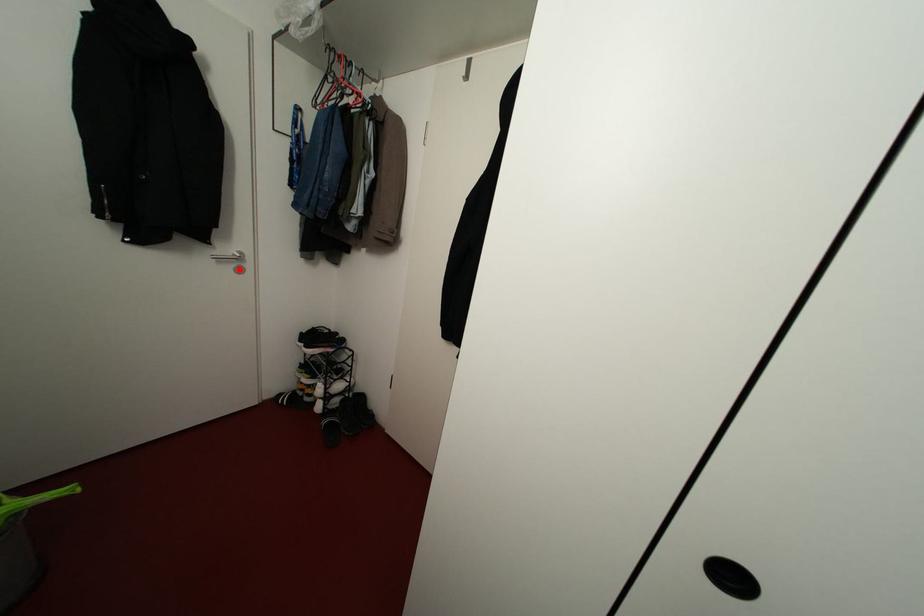
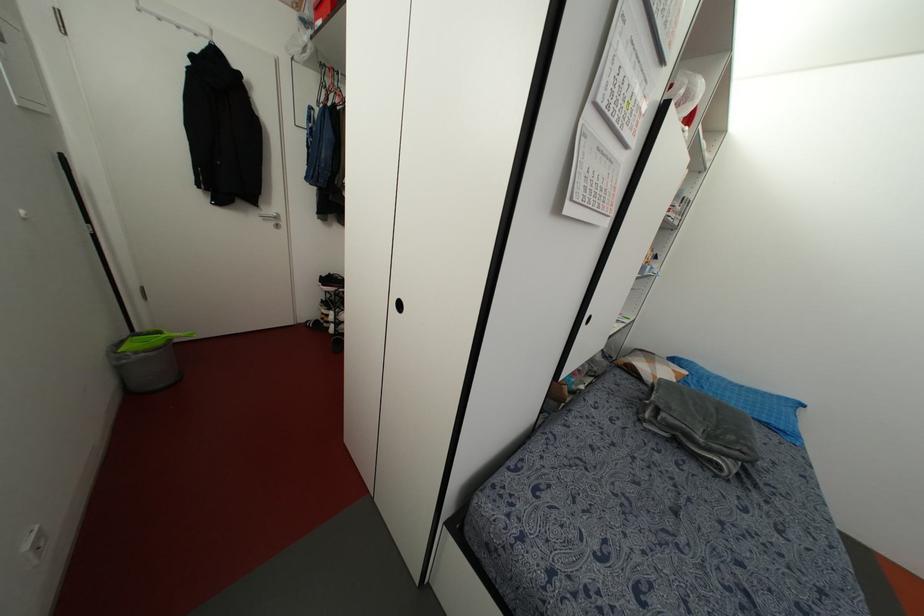
Where in the second image is the point corresponding to the highlighted location from the first image?

(276, 225)